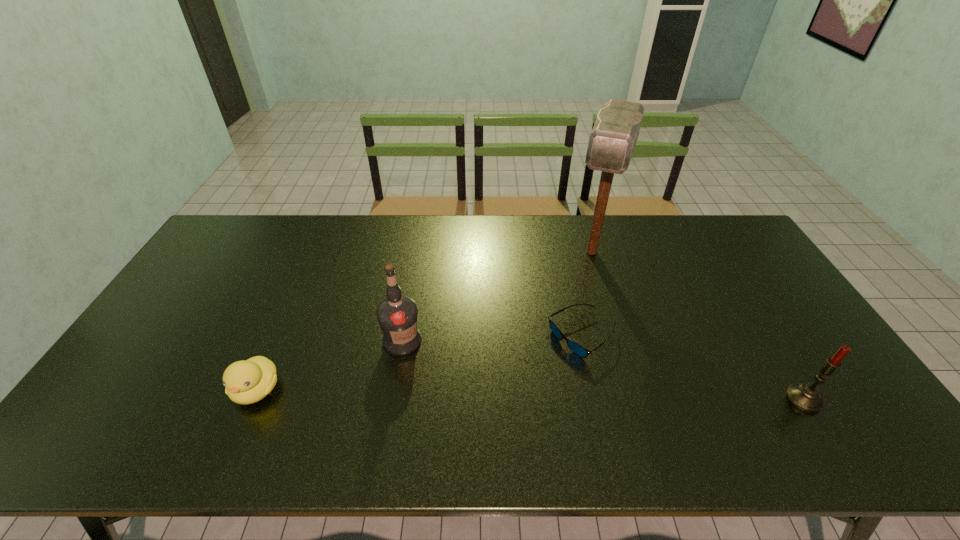
Identify the location of the leftmost object. (248, 381).

Locate an element on the screen. duckling is located at coordinates (248, 381).

The width and height of the screenshot is (960, 540). What are the coordinates of `the rightmost object` in the screenshot? It's located at 807,397.

The image size is (960, 540). I want to click on candle, so click(807, 397).

At what (x,y) coordinates should I click in order to perform the action: click on the tallest object. Please return your answer as a coordinate pair (x, y). Looking at the image, I should click on (611, 144).

Locate an element on the screen. This screenshot has height=540, width=960. mallet is located at coordinates (611, 144).

I want to click on the second object from left to right, so click(397, 315).

Locate an element on the screen. the fourth shortest object is located at coordinates (397, 315).

Where is `sunglasses`? Image resolution: width=960 pixels, height=540 pixels. sunglasses is located at coordinates (577, 349).

Locate an element on the screen. The image size is (960, 540). vacant point located on the right of the rightmost object is located at coordinates (859, 399).